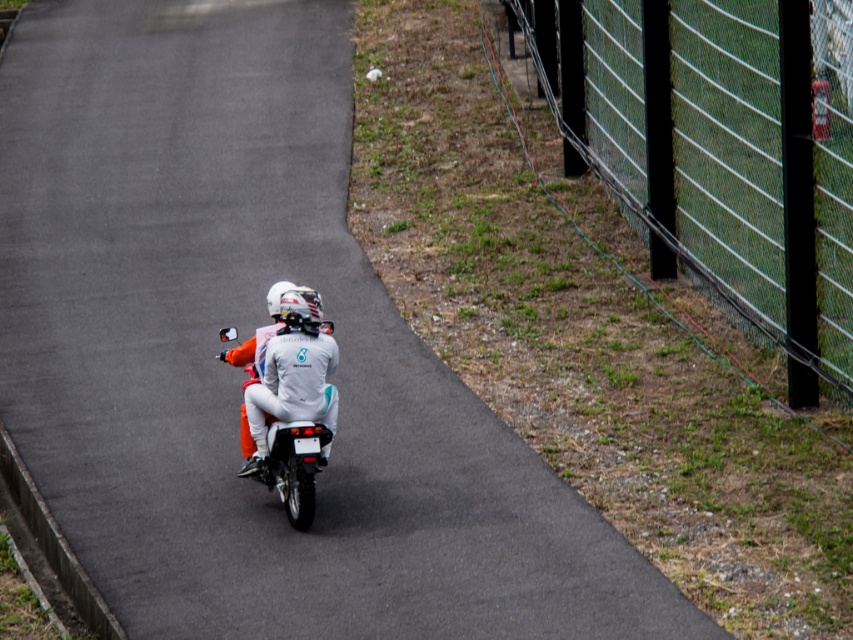
Question: Can you confirm if green mesh fence at right is smaller than white matte motorcycle at center?

Choices:
 (A) yes
 (B) no

Answer: (A)

Question: Which object appears farthest from the camera in this image?

Choices:
 (A) white matte motorcycle at center
 (B) white matte helmet at center
 (C) green mesh fence at right

Answer: (C)

Question: Can you confirm if white matte helmet at center is positioned to the right of white matte motorcycle at center?

Choices:
 (A) no
 (B) yes

Answer: (B)

Question: Which is nearer to the green mesh fence at right?

Choices:
 (A) white matte helmet at center
 (B) white matte motorcycle at center

Answer: (A)

Question: Does green mesh fence at right appear on the right side of white matte helmet at center?

Choices:
 (A) yes
 (B) no

Answer: (A)

Question: Which object appears farthest from the camera in this image?

Choices:
 (A) white matte motorcycle at center
 (B) white matte helmet at center

Answer: (B)